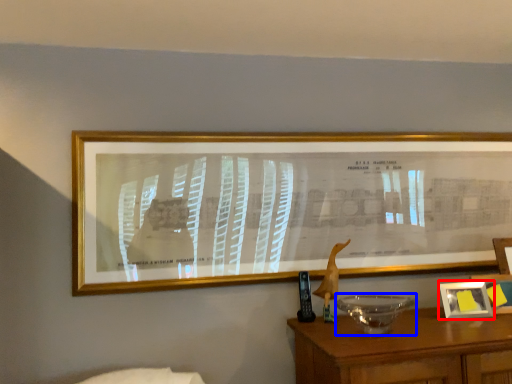
Question: Which object is further to the camera taking this photo, picture frame (highlighted by a red box) or glass bowl (highlighted by a blue box)?

Choices:
 (A) picture frame
 (B) glass bowl

Answer: (A)